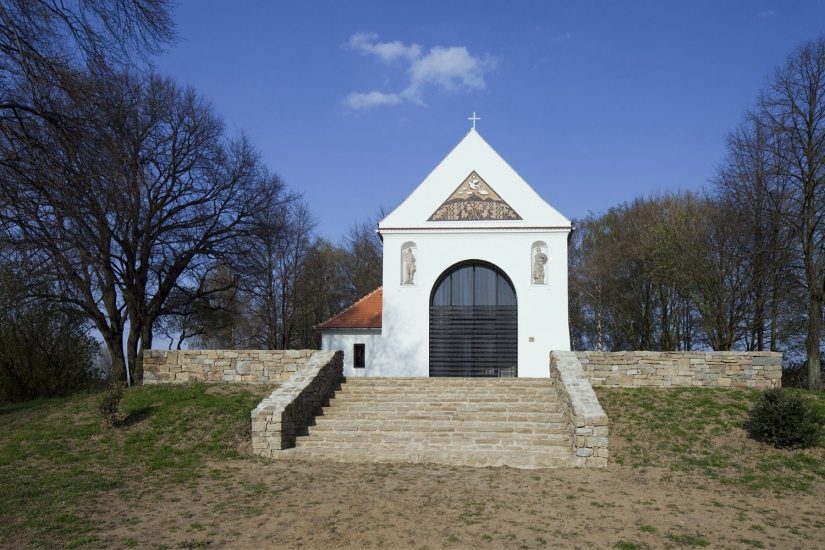
Locate an element on the screen. Image resolution: width=825 pixels, height=550 pixels. stairs is located at coordinates (503, 450), (501, 444), (501, 431), (496, 411), (497, 402), (498, 385).